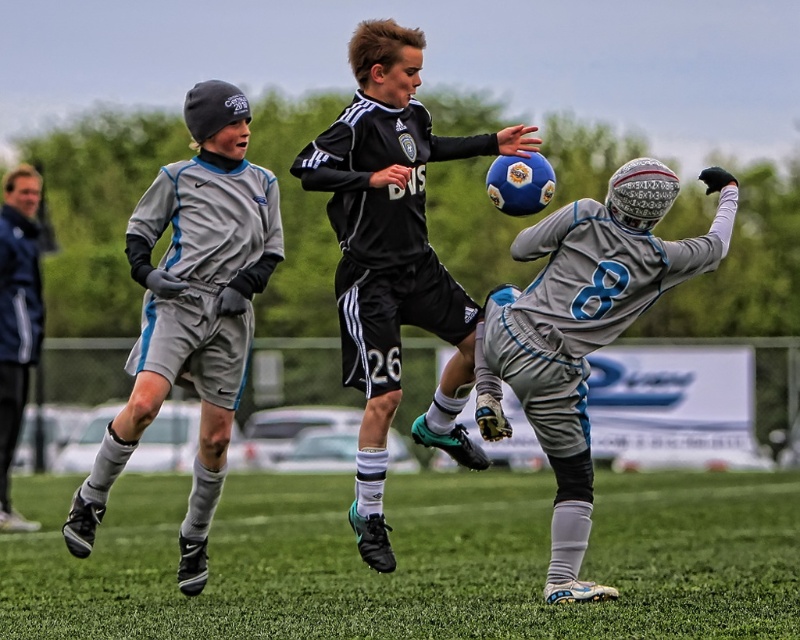
Question: Among these points, which one is nearest to the camera?

Choices:
 (A) pyautogui.click(x=198, y=308)
 (B) pyautogui.click(x=397, y=163)
 (C) pyautogui.click(x=525, y=604)
 (D) pyautogui.click(x=545, y=429)

Answer: (B)

Question: Is green grass at center smaller than dark blue jacket at left?

Choices:
 (A) yes
 (B) no

Answer: (A)

Question: Estimate the real-world distances between objects in this image. Which object is farther from the gray matte soccer uniform at left?

Choices:
 (A) dark blue jacket at left
 (B) black matte soccer ball at center
 (C) green grass at center

Answer: (C)

Question: Which of the following is the closest to the observer?

Choices:
 (A) [x=440, y=513]
 (B) [x=5, y=388]

Answer: (B)

Question: Can you confirm if green grass at center is bigger than gray matte soccer jersey at center?

Choices:
 (A) yes
 (B) no

Answer: (A)

Question: Can you confirm if green grass at center is positioned below gray matte soccer uniform at left?

Choices:
 (A) no
 (B) yes

Answer: (B)